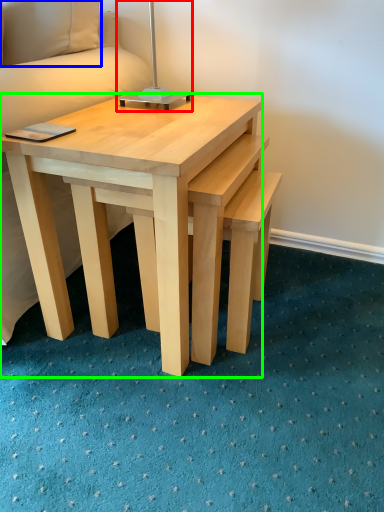
Question: Which object is the farthest from bedside lamp (highlighted by a red box)? Choose among these: pillow (highlighted by a blue box) or coffee table (highlighted by a green box).

Choices:
 (A) pillow
 (B) coffee table

Answer: (B)